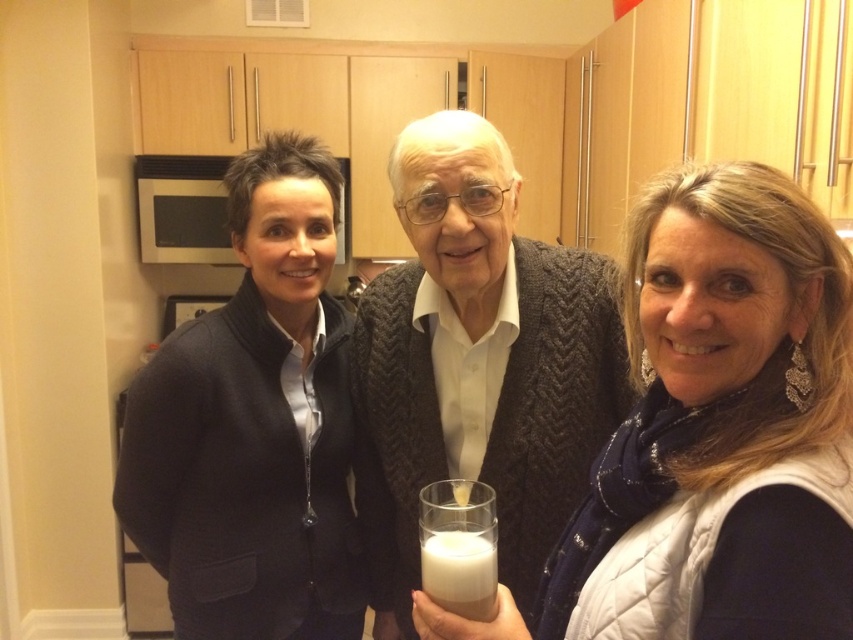
You are trying to decide whether to place a new appliance that is 60 cm wide into the space between the dark gray knitted sweater at center and the stainless steel microwave at left. Can you determine if there is enough space?

The dark gray knitted sweater at center might be wider than the stainless steel microwave at left, so the space between them may not be sufficient for the 60 cm appliance. Check the exact dimensions before placing it.